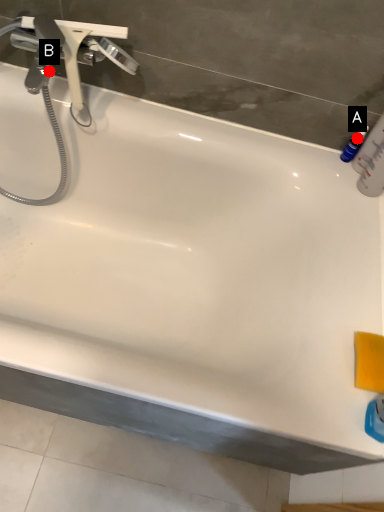
Question: Two points are circled on the image, labeled by A and B beside each circle. Which point is farther to the camera?

Choices:
 (A) A is further
 (B) B is further

Answer: (A)